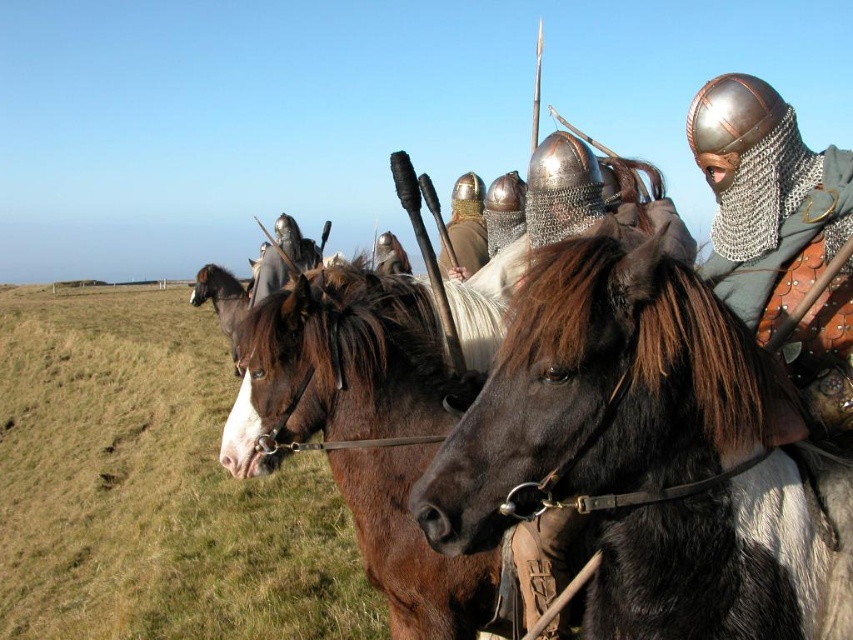
Question: Does green grass at lower left have a greater width compared to shiny black helmet at center?

Choices:
 (A) no
 (B) yes

Answer: (B)

Question: Is brown leather horse at center closer to camera compared to brown glossy horse at left?

Choices:
 (A) no
 (B) yes

Answer: (B)

Question: Estimate the real-world distances between objects in this image. Which object is farther from the metallic helmet at center?

Choices:
 (A) brown glossy horse at left
 (B) shiny black helmet at center
 (C) green grass at lower left
 (D) black leather horse at center

Answer: (C)

Question: Which of the following is the closest to the observer?

Choices:
 (A) (27, 404)
 (B) (267, 378)

Answer: (B)

Question: Does metallic helmet at center come behind brown glossy horse at left?

Choices:
 (A) yes
 (B) no

Answer: (B)

Question: Estimate the real-world distances between objects in this image. Which object is farther from the brown glossy horse at left?

Choices:
 (A) shiny black helmet at center
 (B) black leather horse at center

Answer: (B)